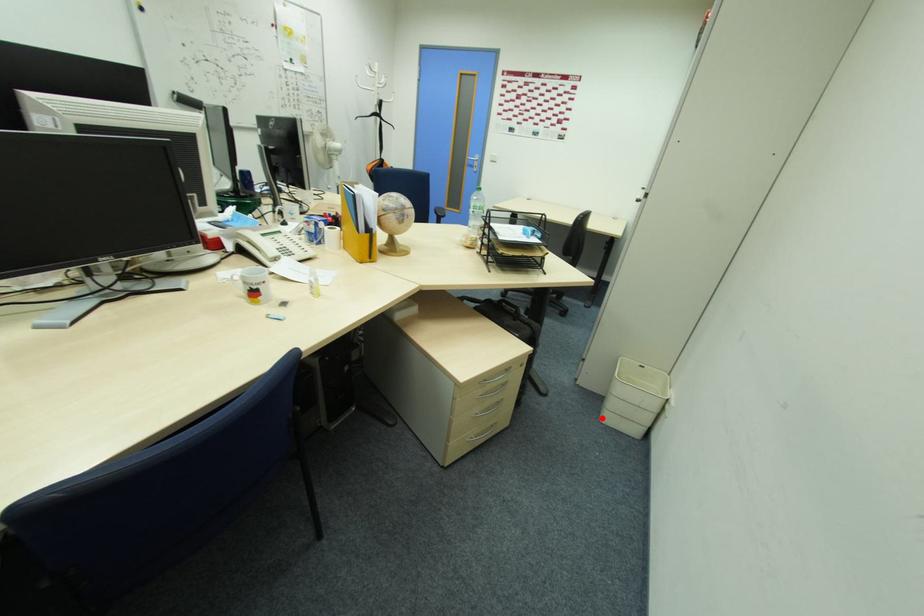
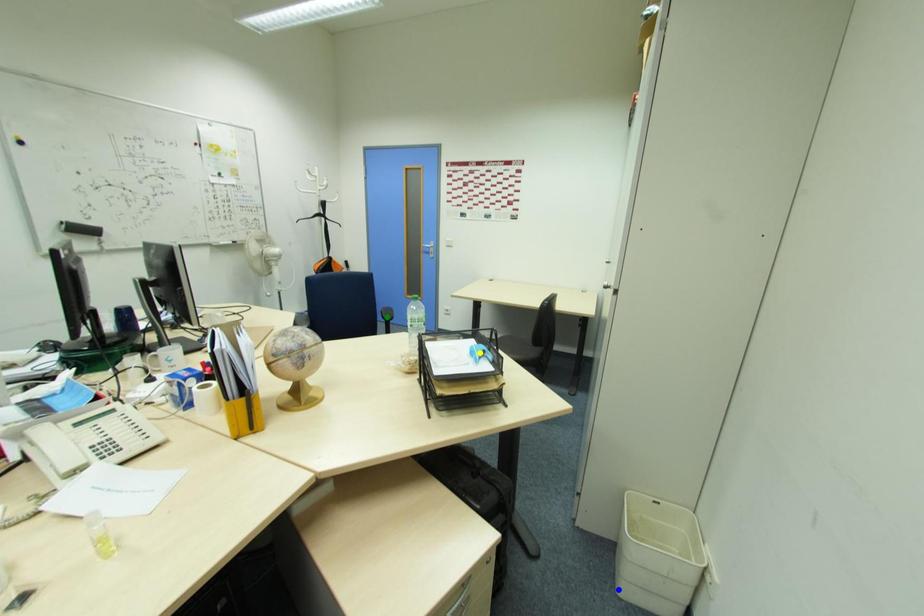
Question: I am providing you with two images of the same scene from different viewpoints. A red point is marked on the first image. You are given multiple points on the second image. Can you choose the point in image 2 that corresponds to the point in image 1?

Choices:
 (A) yellow point
 (B) blue point
 (C) green point

Answer: (B)